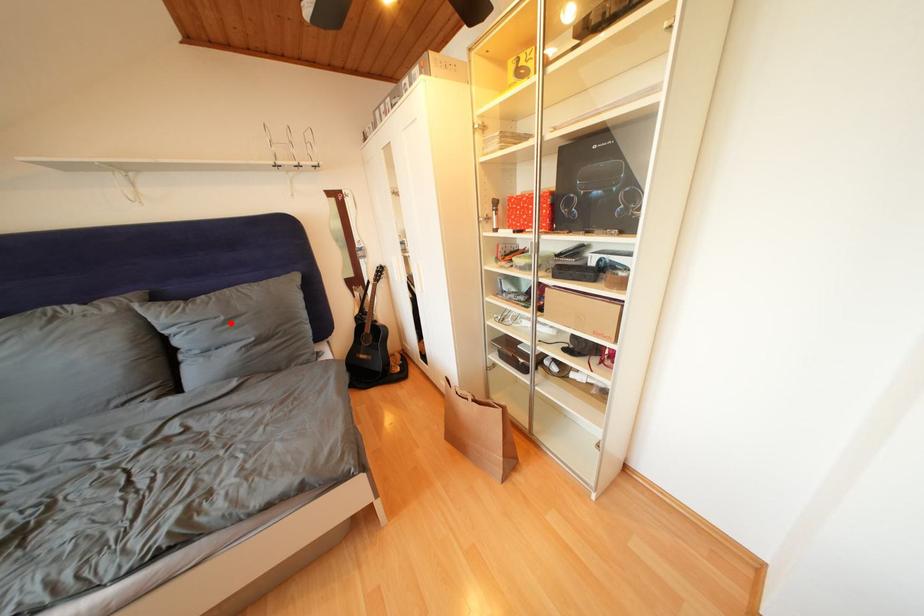
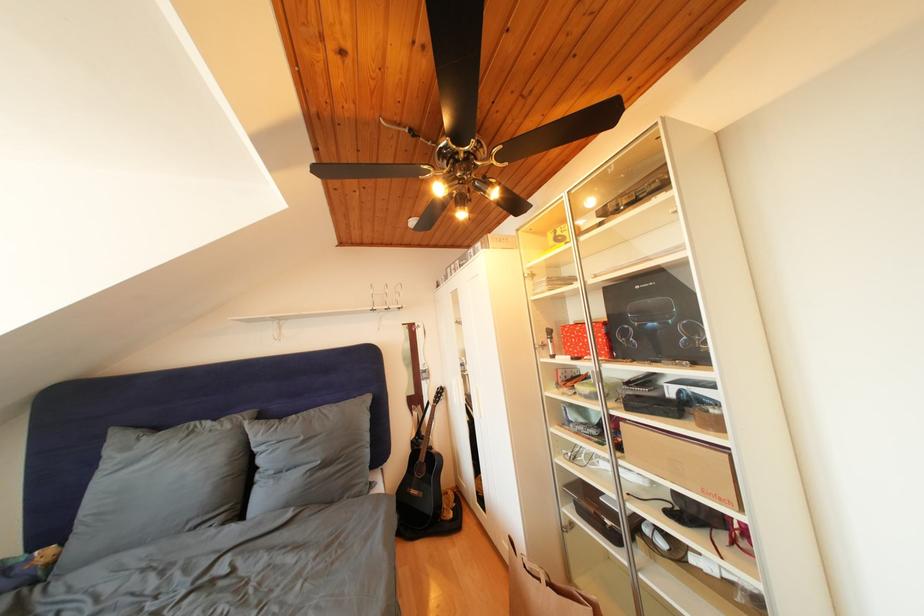
Question: I am providing you with two images of the same scene from different viewpoints. Image1 has a red point marked. In image2, the corresponding 3D location appears at what relative position? Reply with the corresponding letter.

Choices:
 (A) Closer
 (B) Farther

Answer: (B)